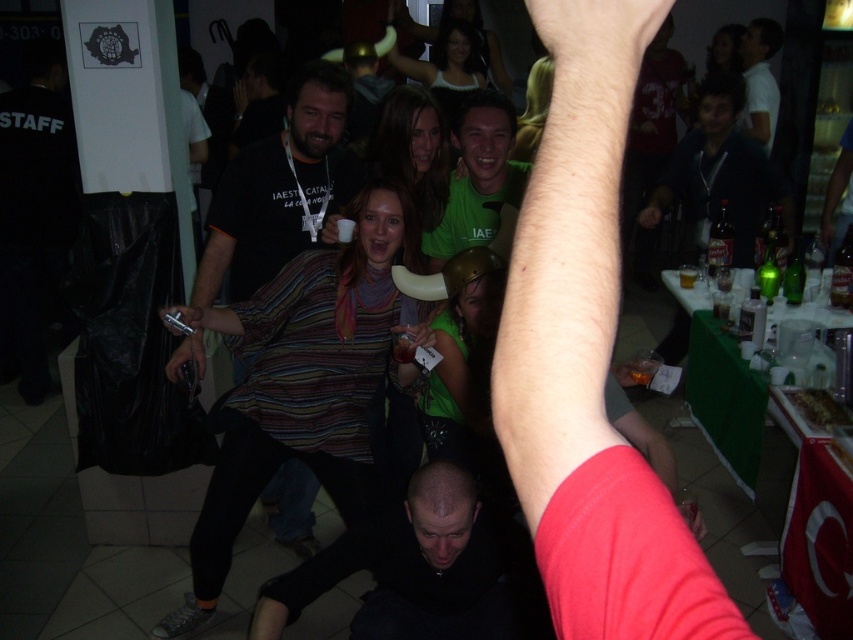
Question: Which of the following is the closest to the observer?

Choices:
 (A) (753, 76)
 (B) (492, 202)

Answer: (B)

Question: Considering the relative positions of dark blue hoodie at upper right and green matte shirt at center in the image provided, where is dark blue hoodie at upper right located with respect to green matte shirt at center?

Choices:
 (A) right
 (B) left

Answer: (A)

Question: Considering the relative positions of dark blue hoodie at upper right and green matte shirt at center in the image provided, where is dark blue hoodie at upper right located with respect to green matte shirt at center?

Choices:
 (A) left
 (B) right

Answer: (B)

Question: Is striped fabric shirt at center above green matte shirt at center?

Choices:
 (A) no
 (B) yes

Answer: (A)

Question: Estimate the real-world distances between objects in this image. Which object is closer to the green matte shirt at center?

Choices:
 (A) black matte shirt at lower center
 (B) dark blue hoodie at upper right

Answer: (A)

Question: Which of the following is the closest to the observer?

Choices:
 (A) black matte shirt at lower center
 (B) dark blue hoodie at upper right
 (C) green matte shirt at center

Answer: (A)